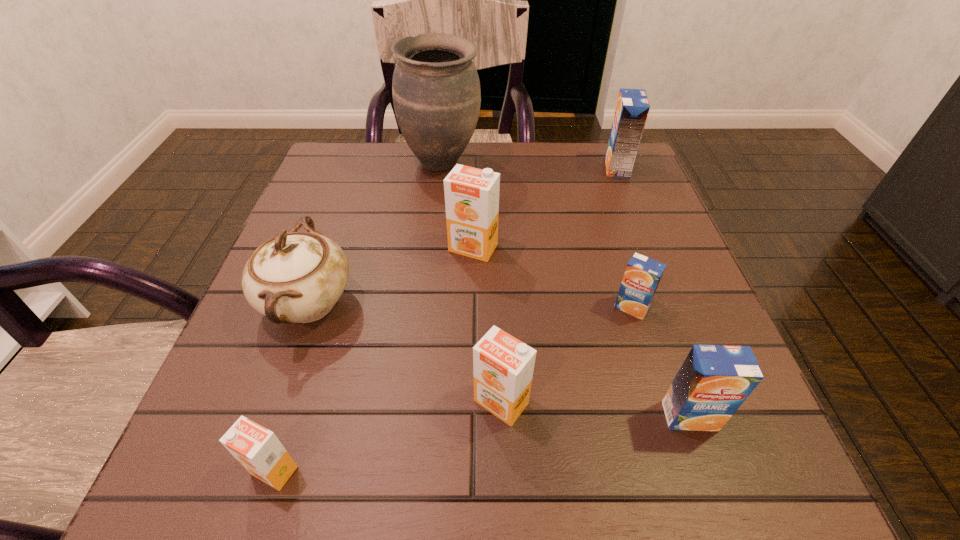
Image resolution: width=960 pixels, height=540 pixels. Identify the location of vacant region at the right edge of the desktop. (666, 314).

Image resolution: width=960 pixels, height=540 pixels. Find the location of `blank space at the far left corner of the desktop`. blank space at the far left corner of the desktop is located at coordinates (366, 156).

In the image, there is a desktop. What are the coordinates of `vacant space at the near right corner` in the screenshot? It's located at (760, 445).

Locate an element on the screen. vacant space in between the farthest blue orange_juice and the nearest orange juice is located at coordinates (445, 319).

At what (x,y) coordinates should I click in order to perform the action: click on vacant point located between the leftmost orange orange juice and the second biggest blue orange_juice. Please return your answer as a coordinate pair (x, y). Looking at the image, I should click on (482, 443).

I want to click on vacant space that's between the leftmost orange orange juice and the tallest object, so click(x=358, y=316).

You are a GUI agent. You are given a task and a screenshot of the screen. Output one action in this format:
    pyautogui.click(x=<x>, y=<y>)
    Task: Click on the unoccupied position between the biggest orange orange juice and the second biggest blue orange_juice
    
    Given the screenshot: What is the action you would take?
    pyautogui.click(x=582, y=332)

Identify the location of free space between the biggest orange orange juice and the white chinaware. (391, 275).

Where is `vacant area between the urn and the chinaware`? The image size is (960, 540). vacant area between the urn and the chinaware is located at coordinates (375, 233).

At what (x,y) coordinates should I click in order to perform the action: click on vacant area that lies between the second smallest orange orange juice and the nearest blue orange_juice. Please return your answer as a coordinate pair (x, y). The image size is (960, 540). Looking at the image, I should click on (595, 409).